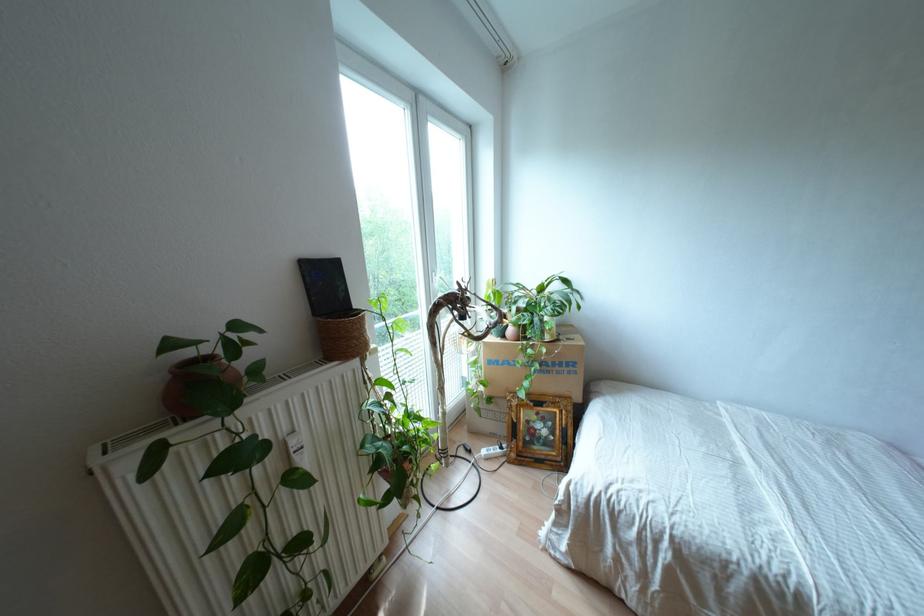
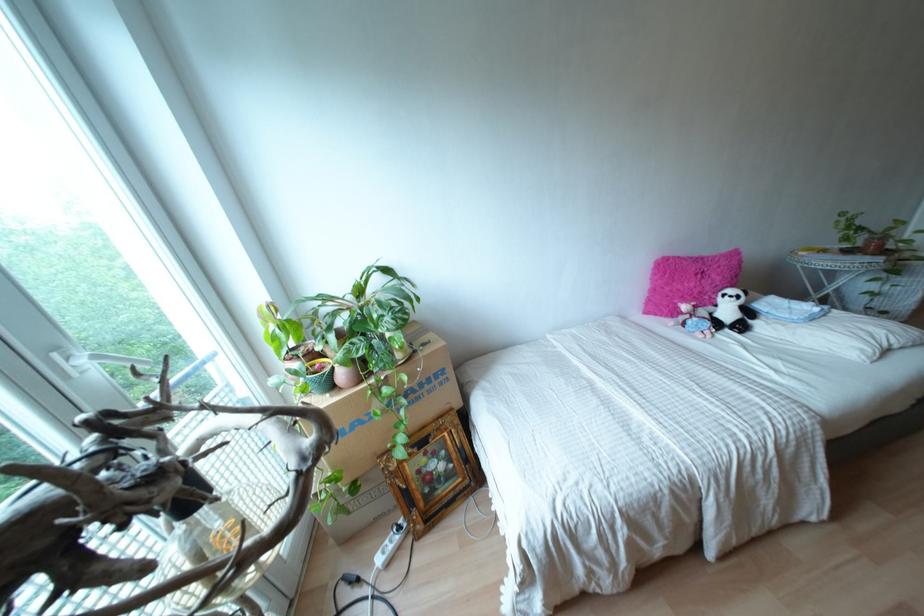
Where in the second image is the point corresponding to (560,363) from the first image?

(428, 379)